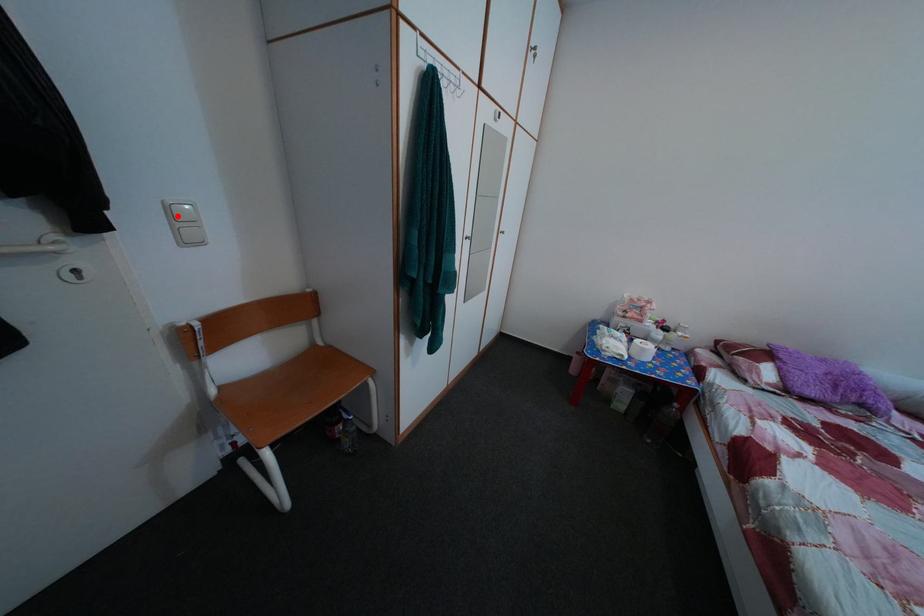
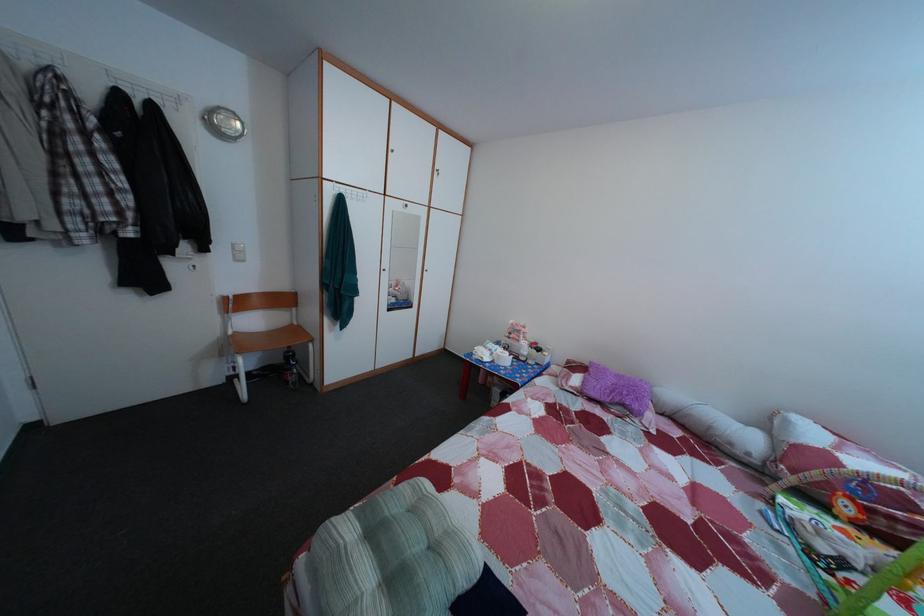
Where in the second image is the point corresponding to the highlighted location from the first image?

(242, 254)